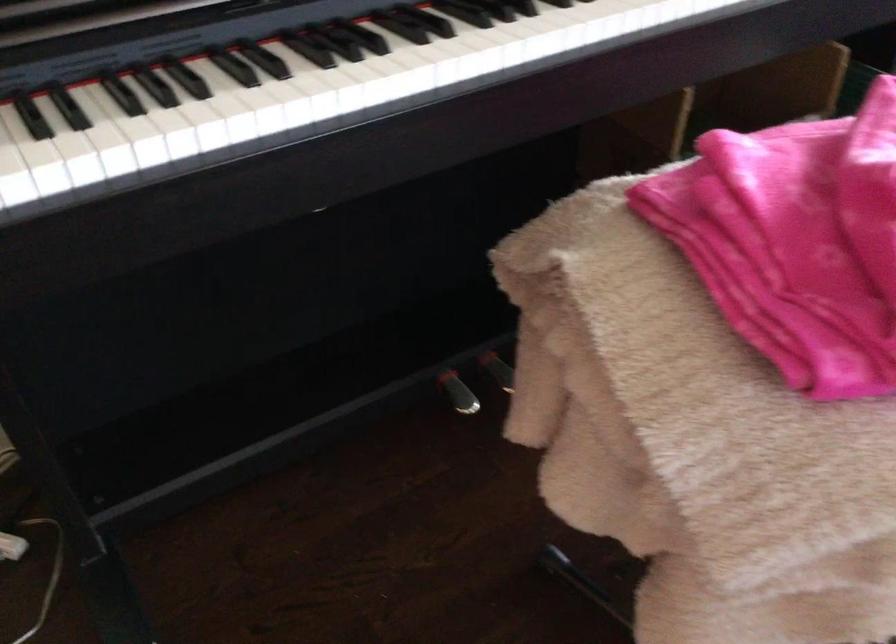
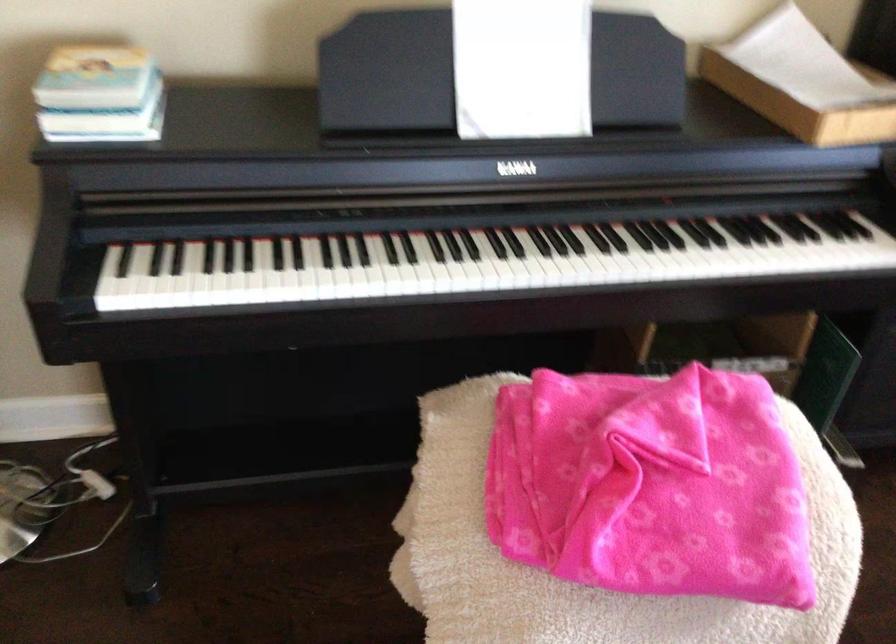
Question: How did the camera likely rotate?

Choices:
 (A) Left
 (B) Right
 (C) Up
 (D) Down

Answer: (A)